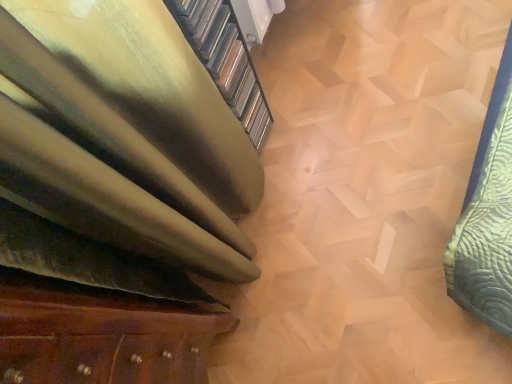
Where is `gold textured stairwell at upper left`? gold textured stairwell at upper left is located at coordinates (225, 60).

What do you see at coordinates (225, 60) in the screenshot?
I see `gold textured stairwell at upper left` at bounding box center [225, 60].

The width and height of the screenshot is (512, 384). What do you see at coordinates (100, 335) in the screenshot?
I see `wooden drawer at lower left` at bounding box center [100, 335].

Where is `wooden drawer at lower left`? wooden drawer at lower left is located at coordinates (100, 335).

At what (x,y) coordinates should I click in order to perform the action: click on gold textured stairwell at upper left. Please return your answer as a coordinate pair (x, y). This screenshot has width=512, height=384. Looking at the image, I should click on (225, 60).

Would you say gold textured stairwell at upper left is to the left or to the right of wooden drawer at lower left in the picture?

gold textured stairwell at upper left is to the right of wooden drawer at lower left.

Is gold textured stairwell at upper left positioned before wooden drawer at lower left?

No, the depth of gold textured stairwell at upper left is greater than that of wooden drawer at lower left.

Which point is more forward, (222, 81) or (114, 381)?

The point (114, 381) is more forward.

From the image's perspective, between gold textured stairwell at upper left and wooden drawer at lower left, who is located below?

wooden drawer at lower left, from the image's perspective.

From a real-world perspective, is gold textured stairwell at upper left above or below wooden drawer at lower left?

From a real-world perspective, gold textured stairwell at upper left is physically below wooden drawer at lower left.

From the picture: Is gold textured stairwell at upper left wider than wooden drawer at lower left?

No.

From the picture: Considering the relative sizes of gold textured stairwell at upper left and wooden drawer at lower left in the image provided, is gold textured stairwell at upper left shorter than wooden drawer at lower left?

Yes, gold textured stairwell at upper left is shorter than wooden drawer at lower left.

Is gold textured stairwell at upper left smaller than wooden drawer at lower left?

Yes, gold textured stairwell at upper left is smaller than wooden drawer at lower left.

Would you say gold textured stairwell at upper left contains wooden drawer at lower left?

No, wooden drawer at lower left is not a part of gold textured stairwell at upper left.

Can you see gold textured stairwell at upper left touching wooden drawer at lower left?

No, gold textured stairwell at upper left is not touching wooden drawer at lower left.

From the picture: Could you tell me if gold textured stairwell at upper left is facing wooden drawer at lower left?

No, gold textured stairwell at upper left is not aimed at wooden drawer at lower left.

Identify the location of furniture in front of the gold textured stairwell at upper left. (100, 335).

Does wooden drawer at lower left appear on the right side of gold textured stairwell at upper left?

Incorrect, wooden drawer at lower left is not on the right side of gold textured stairwell at upper left.

Which object is further away from the camera, wooden drawer at lower left or gold textured stairwell at upper left?

Positioned behind is gold textured stairwell at upper left.

Does point (0, 291) lie behind point (238, 39)?

No, it is in front of (238, 39).

From the image's perspective, which is below, wooden drawer at lower left or gold textured stairwell at upper left?

wooden drawer at lower left, from the image's perspective.

From a real-world perspective, relative to gold textured stairwell at upper left, is wooden drawer at lower left vertically above or below?

Clearly, from a real-world perspective, wooden drawer at lower left is above gold textured stairwell at upper left.

Does wooden drawer at lower left have a lesser width compared to gold textured stairwell at upper left?

In fact, wooden drawer at lower left might be wider than gold textured stairwell at upper left.

Who is taller, wooden drawer at lower left or gold textured stairwell at upper left?

wooden drawer at lower left is taller.

Between wooden drawer at lower left and gold textured stairwell at upper left, which one has larger size?

Bigger between the two is wooden drawer at lower left.

Is wooden drawer at lower left inside the boundaries of gold textured stairwell at upper left, or outside?

wooden drawer at lower left is outside gold textured stairwell at upper left.

Would you consider wooden drawer at lower left to be distant from gold textured stairwell at upper left?

No, wooden drawer at lower left is not far away from gold textured stairwell at upper left.

Is wooden drawer at lower left positioned with its back to gold textured stairwell at upper left?

wooden drawer at lower left is not turned away from gold textured stairwell at upper left.

What's the angular difference between wooden drawer at lower left and gold textured stairwell at upper left's facing directions?

The facing directions of wooden drawer at lower left and gold textured stairwell at upper left are 0.646 degrees apart.

Locate an element on the screen. This screenshot has height=384, width=512. stairwell lying on the right of wooden drawer at lower left is located at coordinates (225, 60).

This screenshot has width=512, height=384. In order to click on stairwell that appears above the wooden drawer at lower left (from the image's perspective) in this screenshot , I will do `click(225, 60)`.

Find the location of a particular element. stairwell behind the wooden drawer at lower left is located at coordinates (225, 60).